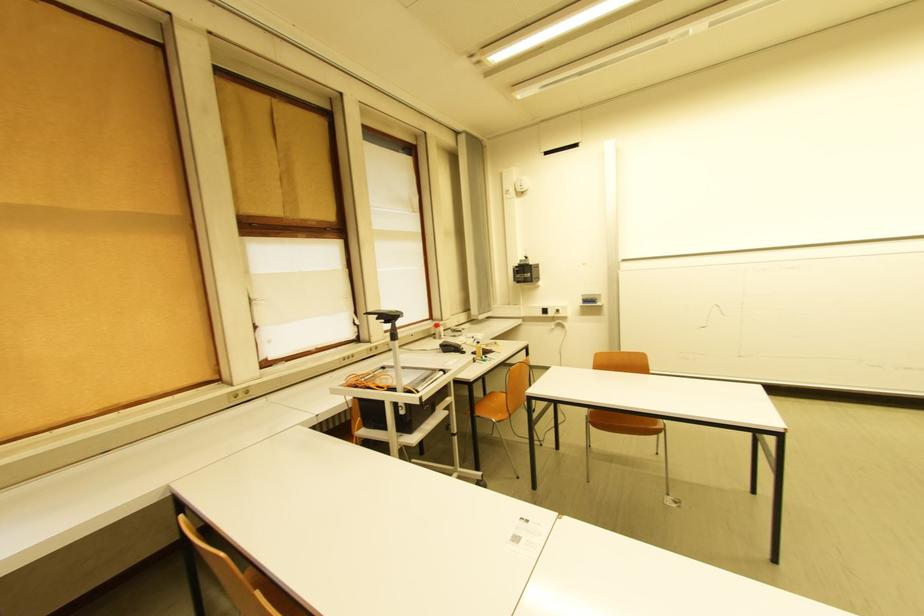
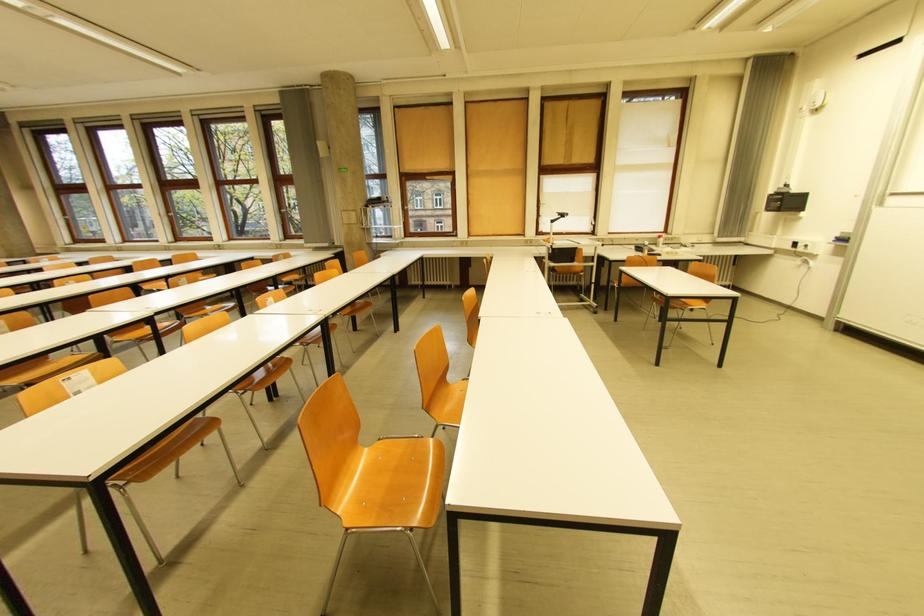
Find the pixel in the second image that matches point (420, 213) in the first image.

(676, 148)